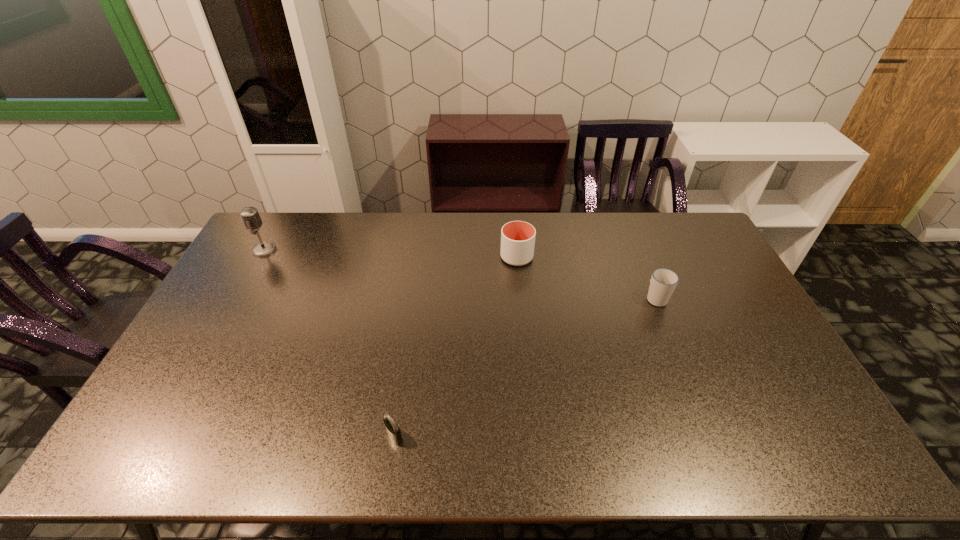
Image resolution: width=960 pixels, height=540 pixels. In order to click on vacant space situated 0.350m with a handle on the side of the right cup in this screenshot , I will do `click(627, 225)`.

What are the coordinates of `blank space located 0.250m with a handle on the side of the right cup` in the screenshot? It's located at (633, 241).

Find the location of `vacant space situated 0.340m with a handle on the side of the right cup`. vacant space situated 0.340m with a handle on the side of the right cup is located at coordinates (627, 227).

Identify the location of free space located 0.360m on the right of the padlock. This screenshot has width=960, height=540. (551, 436).

Identify the location of microphone present at the far edge. The height and width of the screenshot is (540, 960). (250, 216).

Locate an element on the screen. This screenshot has width=960, height=540. cup that is at the far edge is located at coordinates (517, 237).

Where is `object present at the near edge`? The width and height of the screenshot is (960, 540). object present at the near edge is located at coordinates (393, 431).

Where is `object present at the left edge`? Image resolution: width=960 pixels, height=540 pixels. object present at the left edge is located at coordinates (250, 216).

Locate an element on the screen. The width and height of the screenshot is (960, 540). object located in the far left corner section of the desktop is located at coordinates (250, 216).

This screenshot has width=960, height=540. In the image, there is a desktop. Find the location of `vacant area at the far edge`. vacant area at the far edge is located at coordinates (402, 238).